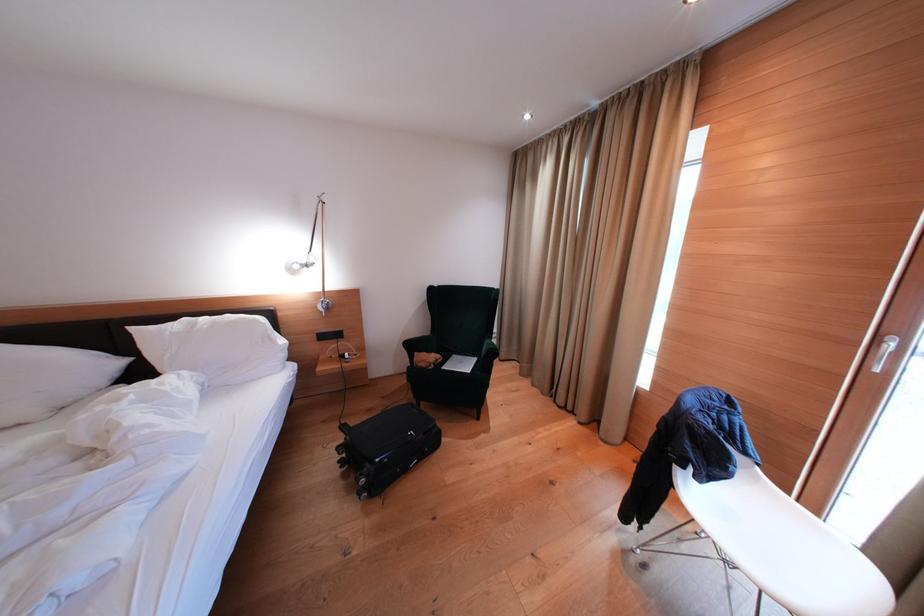
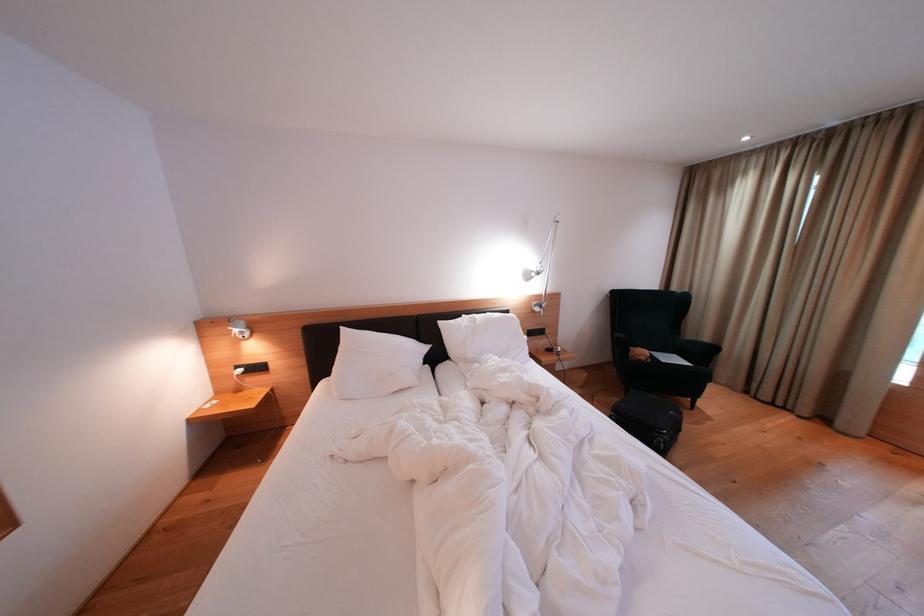
In the second image, find the point that corresponds to (140,334) in the first image.

(447, 328)